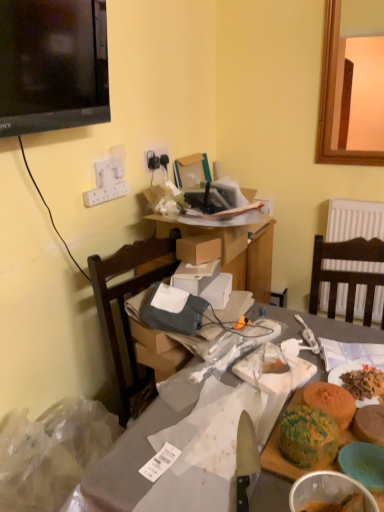
Find the location of a particular element. vacant region to the left of shiny silver knife at center is located at coordinates (173, 462).